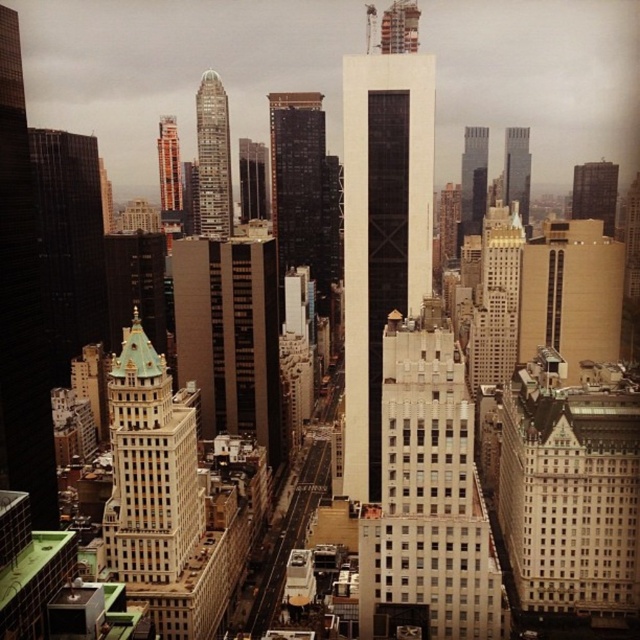
Question: Does beige concrete building at center-right appear under glassy reflective skyscraper at upper right?

Choices:
 (A) no
 (B) yes

Answer: (B)

Question: Does white stone building at center appear under glassy reflective skyscraper at upper right?

Choices:
 (A) no
 (B) yes

Answer: (B)

Question: Considering the real-world distances, which object is closest to the glassy reflective skyscraper at upper right?

Choices:
 (A) white stone building at center
 (B) matte glass skyscraper at upper right
 (C) beige concrete building at center-right
 (D) glassy reflective skyscraper at center

Answer: (D)

Question: Is black glass building at center wider than glassy silver skyscraper at center?

Choices:
 (A) no
 (B) yes

Answer: (B)

Question: Estimate the real-world distances between objects in this image. Which object is closer to the brown glass building at center?

Choices:
 (A) white stone building at center
 (B) glassy reflective skyscraper at upper right

Answer: (A)

Question: Which is nearer to the white textured building at center?

Choices:
 (A) orange brick building at upper center
 (B) beige concrete building at center-right
 (C) brown glass building at center
 (D) matte glass skyscraper at upper right

Answer: (C)